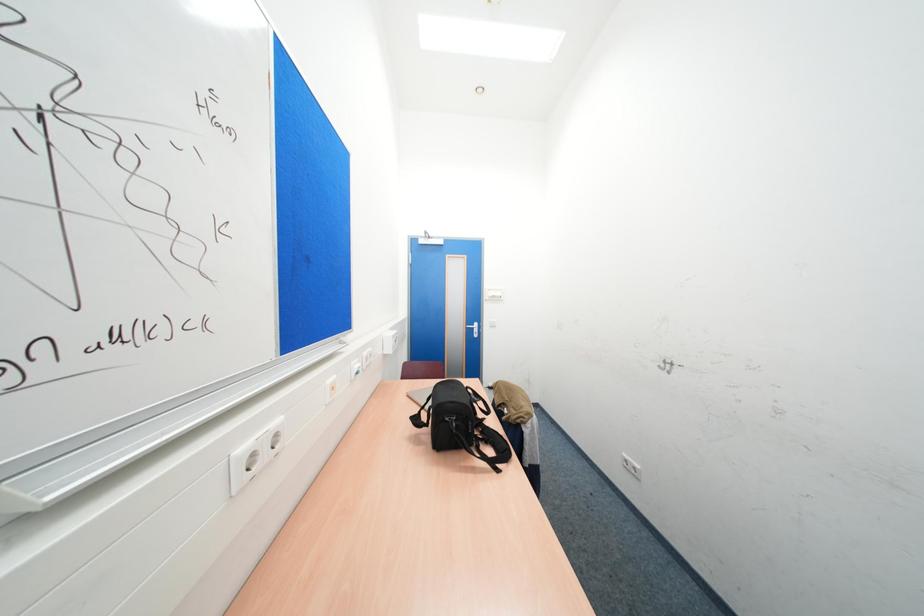
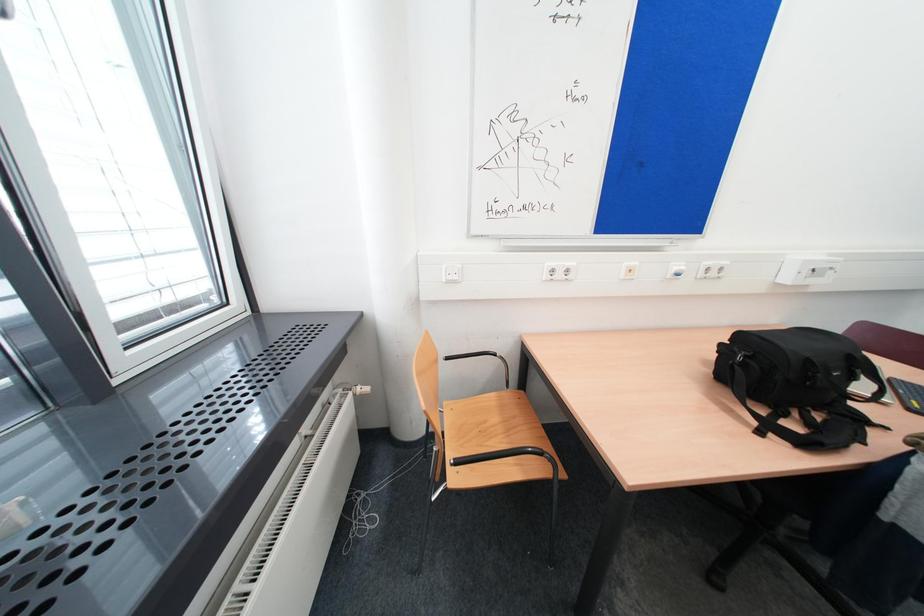
How did the camera likely rotate?

The rotation direction of the camera is left-down.